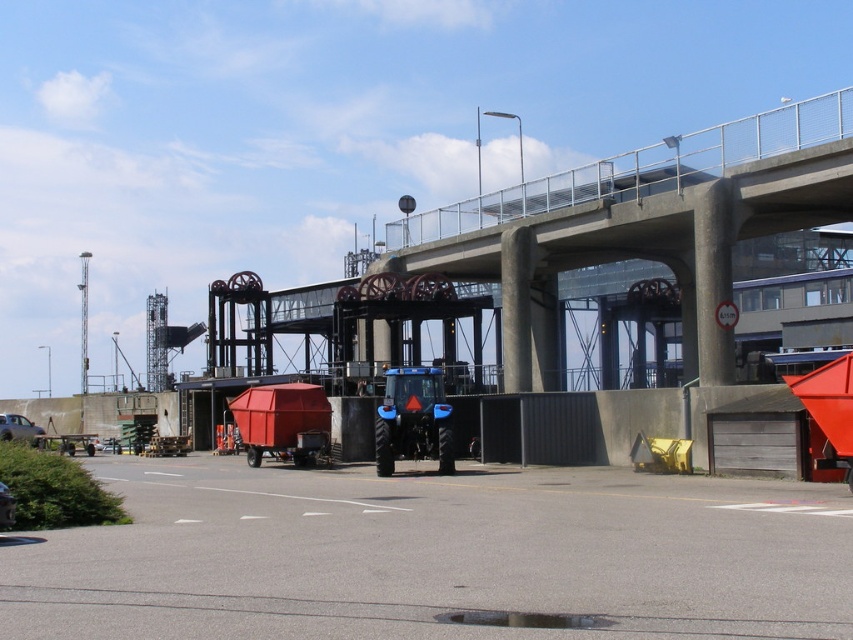
You are standing at the point labeled point (x=19, y=428) in the image. What object is located at that point?

The brushed metal car at lower left is located at point (x=19, y=428).

You are driving a truck that needs to park in the loading zone. There are two cars blocking the entrance to the zone, a brushed metal car at lower left and a metallic silver car at lower left. Which car should you move first to clear the path?

The brushed metal car at lower left is larger in size than metallic silver car at lower left, so you should move the larger brushed metal car at lower left first to clear the path.